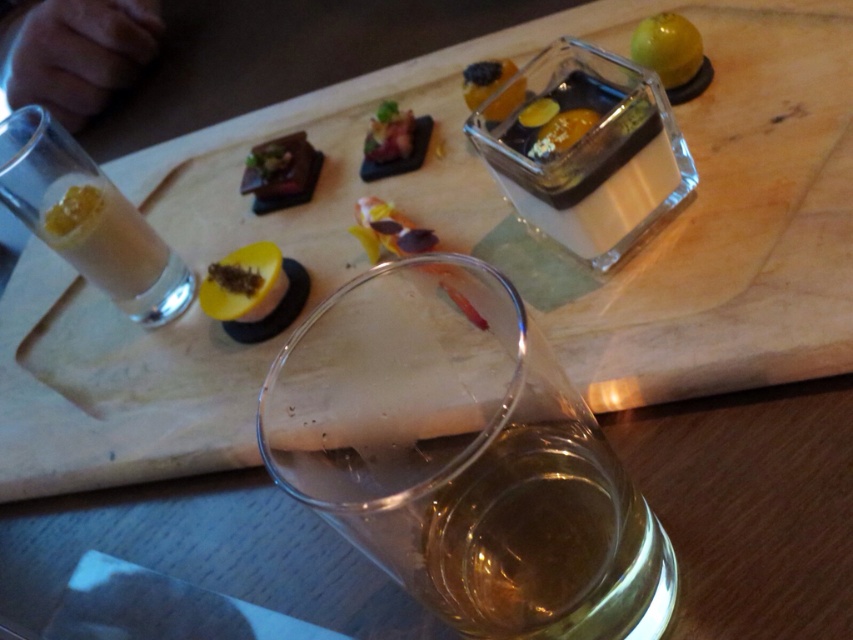
Question: Which point is farther to the camera?

Choices:
 (A) (221, 282)
 (B) (51, 204)

Answer: (B)

Question: Is translucent glass cube at upper center thinner than shiny red meat at center?

Choices:
 (A) no
 (B) yes

Answer: (A)

Question: Which object appears closest to the camera in this image?

Choices:
 (A) matte brown tart at upper left
 (B) translucent glass cube at upper center

Answer: (B)

Question: Does white creamy juice at left appear under yellow matte apple at upper right?

Choices:
 (A) no
 (B) yes

Answer: (B)

Question: Among these objects, which one is nearest to the camera?

Choices:
 (A) yellow matte passion fruit at center
 (B) translucent glass at center

Answer: (B)

Question: Considering the relative positions of yellow matte apple at upper right and translucent glass cube at upper center in the image provided, where is yellow matte apple at upper right located with respect to translucent glass cube at upper center?

Choices:
 (A) right
 (B) left

Answer: (A)